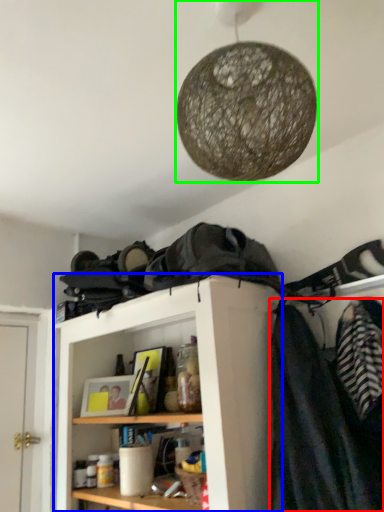
Question: Based on their relative distances, which object is nearer to clothing (highlighted by a red box)? Choose from shelf (highlighted by a blue box) and lamp (highlighted by a green box).

Choices:
 (A) shelf
 (B) lamp

Answer: (A)